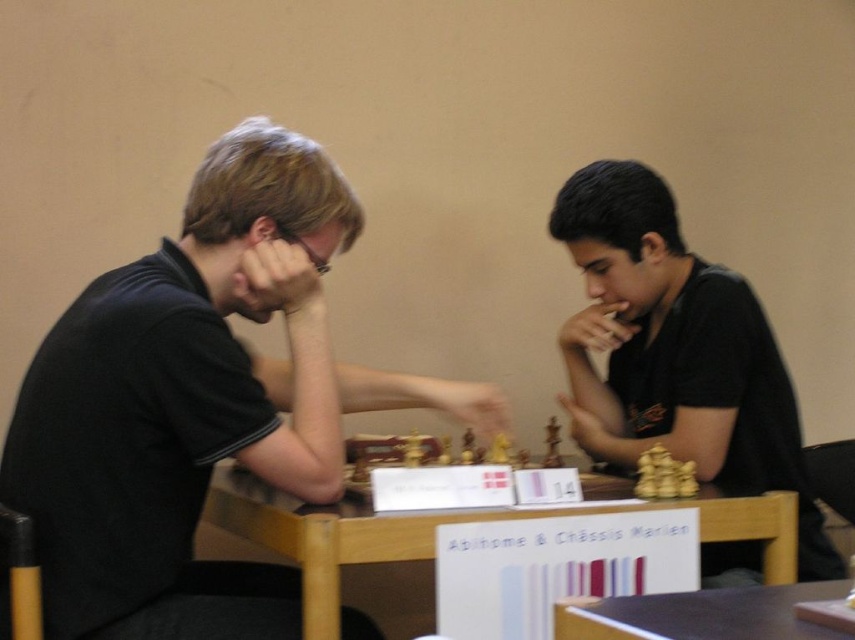
How distant is wooden at center from wooden chess set at center?

wooden at center and wooden chess set at center are 6.50 inches apart from each other.

Does wooden at center have a smaller size compared to wooden chess set at center?

No.

Does point (329, 529) come in front of point (433, 452)?

Yes, point (329, 529) is in front of point (433, 452).

Image resolution: width=855 pixels, height=640 pixels. I want to click on wooden at center, so [x=443, y=524].

Is black matte shirt at center smaller than wooden at center?

No.

Is black matte shirt at center thinner than wooden at center?

Indeed, black matte shirt at center has a lesser width compared to wooden at center.

Between point (604, 460) and point (792, 566), which one is positioned in front?

Point (792, 566) is more forward.

Locate an element on the screen. black matte shirt at center is located at coordinates (675, 352).

Is wooden at center below brown wooden table at lower center?

Correct, wooden at center is located below brown wooden table at lower center.

From the picture: Who is positioned more to the left, wooden at center or brown wooden table at lower center?

Positioned to the left is wooden at center.

Locate an element on the screen. The height and width of the screenshot is (640, 855). wooden at center is located at coordinates (443, 524).